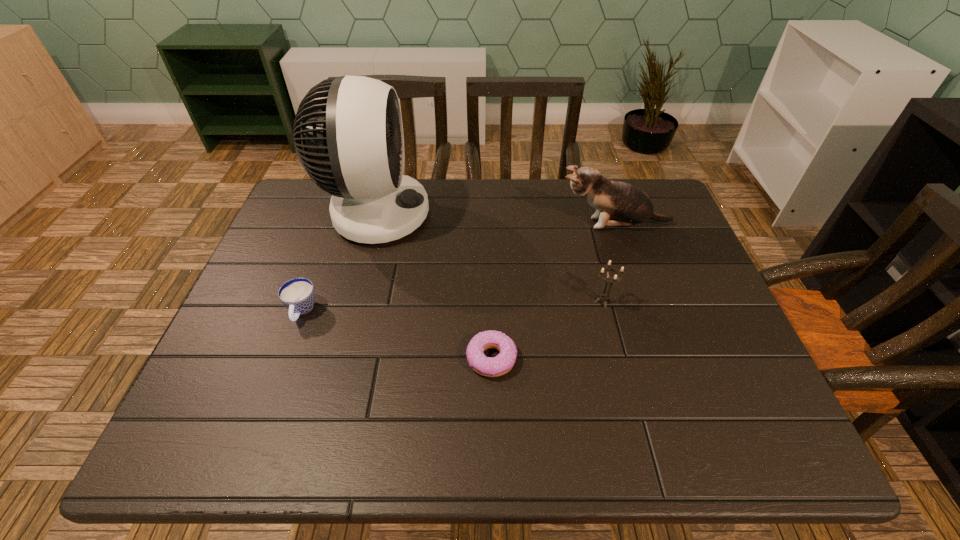
At what (x,y) coordinates should I click in order to perform the action: click on fan. Please return your answer as a coordinate pair (x, y). Image resolution: width=960 pixels, height=540 pixels. Looking at the image, I should click on (348, 131).

Locate an element on the screen. cat is located at coordinates (617, 203).

Where is `candle holder`? Image resolution: width=960 pixels, height=540 pixels. candle holder is located at coordinates (604, 297).

The height and width of the screenshot is (540, 960). In order to click on the fourth tallest object in this screenshot , I will do `click(298, 295)`.

Identify the location of the nearest object. The image size is (960, 540). (501, 364).

Find the location of `doughnut`. doughnut is located at coordinates (501, 364).

Find the location of `free space located 0.080m on the grille of the tallest object`. free space located 0.080m on the grille of the tallest object is located at coordinates (457, 214).

Identify the location of vacant space situated at the face of the second tallest object. (437, 224).

You are a GUI agent. You are given a task and a screenshot of the screen. Output one action in this format:
    pyautogui.click(x=<x>, y=<y>)
    Task: Click on the vacant space situated 0.400m at the face of the second tallest object
    Image resolution: width=960 pixels, height=540 pixels.
    Given the screenshot: What is the action you would take?
    [416, 224]

Where is `vacant space situated at the face of the second tallest object`? The image size is (960, 540). vacant space situated at the face of the second tallest object is located at coordinates (416, 224).